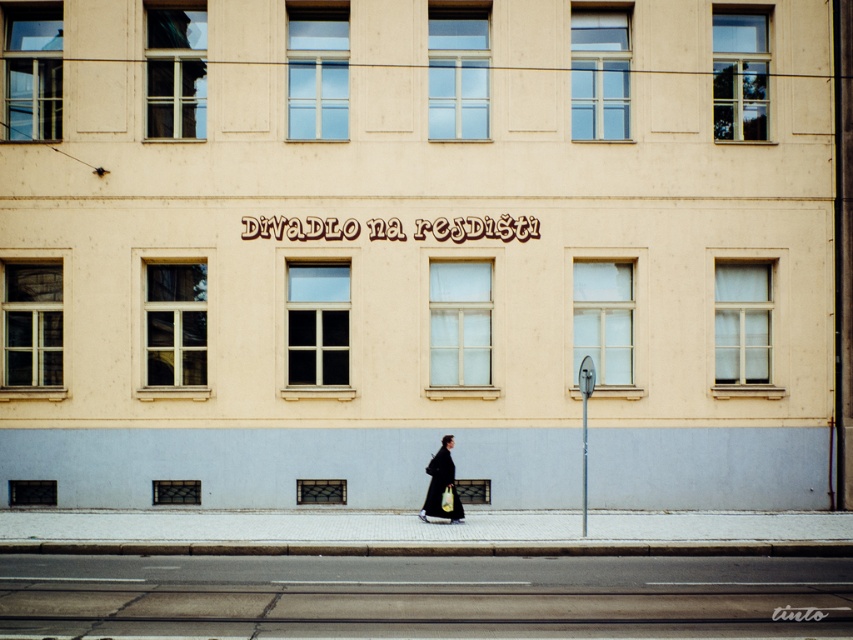
Can you confirm if gray asphalt at lower center is smaller than dark matte coat at center?

Indeed, gray asphalt at lower center has a smaller size compared to dark matte coat at center.

Identify the location of gray asphalt at lower center. (424, 595).